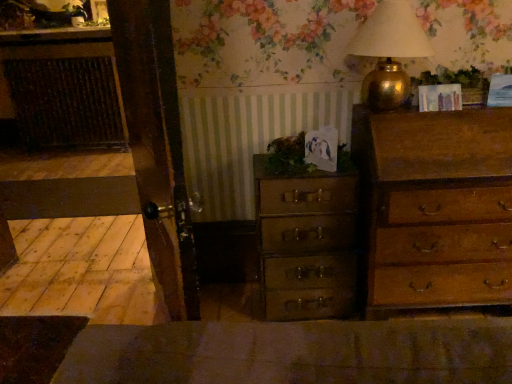
At what (x,y) coordinates should I click in order to perform the action: click on free spot in front of green leafy plant at upper right, which is the 1th plant from top to bottom. Please return your answer as a coordinate pair (x, y). Looking at the image, I should click on (464, 109).